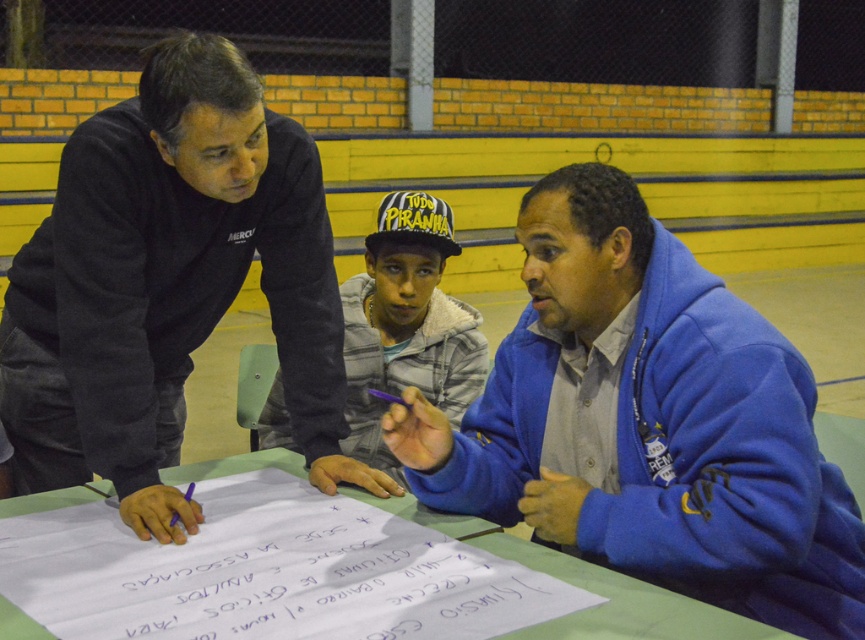
Question: Which object appears farthest from the camera in this image?

Choices:
 (A) white paper at center
 (B) blue fleece jacket at center
 (C) green paper at center

Answer: (B)

Question: Is the position of white paper at center more distant than that of green paper at center?

Choices:
 (A) no
 (B) yes

Answer: (A)

Question: Is dark gray sweatshirt at upper left below white fleece jacket at center?

Choices:
 (A) no
 (B) yes

Answer: (A)

Question: Which of these objects is positioned closest to the white fleece jacket at center?

Choices:
 (A) dark gray sweatshirt at upper left
 (B) yellow and black baseball cap at center
 (C) blue fleece jacket at center

Answer: (B)

Question: Is white paper at center positioned at the back of green paper at center?

Choices:
 (A) yes
 (B) no

Answer: (B)

Question: Which of the following is the farthest from the observer?

Choices:
 (A) (61, 164)
 (B) (106, 490)
 (C) (450, 300)
 (D) (511, 358)

Answer: (C)